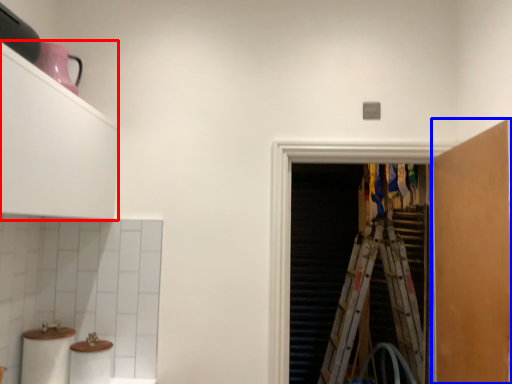
Question: Which object appears closest to the camera in this image, cabinetry (highlighted by a red box) or cabinetry (highlighted by a blue box)?

Choices:
 (A) cabinetry
 (B) cabinetry

Answer: (A)